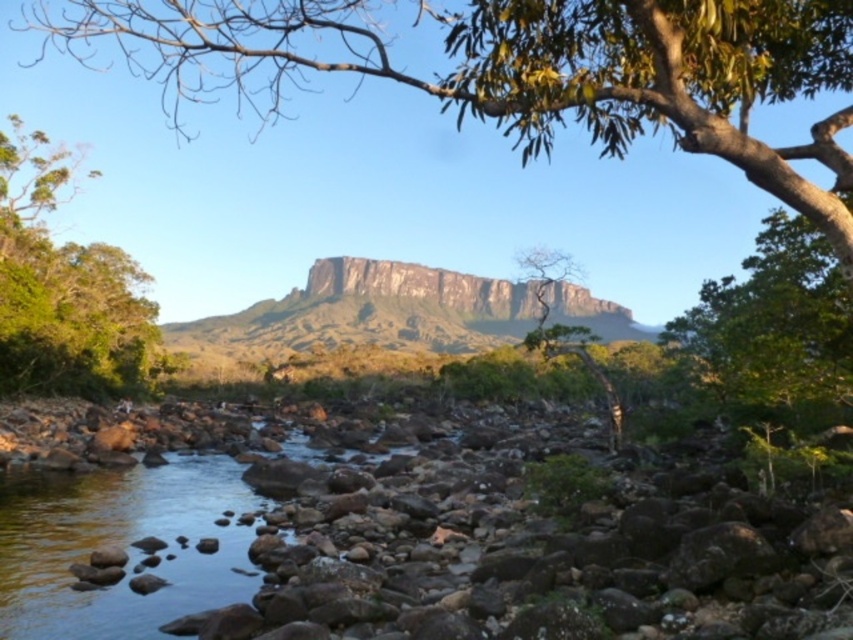
Question: Where is green leafy tree at left located in relation to brown rocky mountain at center in the image?

Choices:
 (A) below
 (B) above

Answer: (A)

Question: Estimate the real-world distances between objects in this image. Which object is farther from the green leafy tree at center?

Choices:
 (A) green leafy tree at left
 (B) brown rocky mountain at center

Answer: (A)

Question: Does brown rocky mountain at center appear on the right side of green leafy tree at center?

Choices:
 (A) yes
 (B) no

Answer: (B)

Question: Estimate the real-world distances between objects in this image. Which object is farther from the brown rocky mountain at center?

Choices:
 (A) green leafy tree at left
 (B) green leafy tree at center

Answer: (A)

Question: Does brown rocky mountain at center have a larger size compared to green leafy tree at center?

Choices:
 (A) no
 (B) yes

Answer: (B)

Question: Which point is closer to the camera?

Choices:
 (A) (474, 349)
 (B) (544, 344)

Answer: (B)